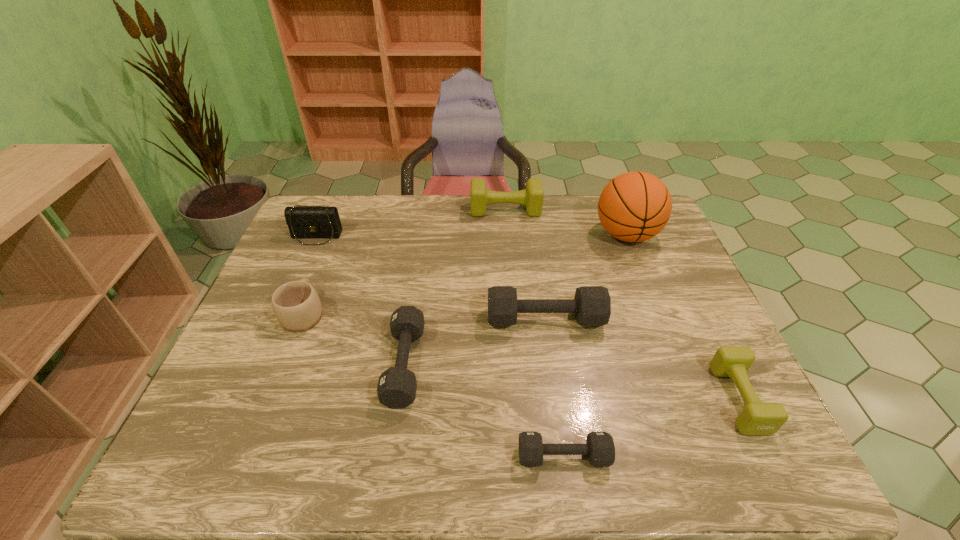
This screenshot has width=960, height=540. What are the coordinates of `the smaller olive dumbbell` in the screenshot? It's located at (757, 418).

The height and width of the screenshot is (540, 960). In order to click on the smallest gray dumbbell in this screenshot , I will do `click(599, 447)`.

Locate an element on the screen. This screenshot has width=960, height=540. the nearest gray dumbbell is located at coordinates (599, 447).

You are a GUI agent. You are given a task and a screenshot of the screen. Output one action in this format:
    pyautogui.click(x=<x>, y=<y>)
    Task: Click on the vacant position located 0.160m on the left of the tallest object
    The height and width of the screenshot is (540, 960).
    Given the screenshot: What is the action you would take?
    pyautogui.click(x=543, y=235)

The width and height of the screenshot is (960, 540). I want to click on vacant area situated 0.250m on the left of the bigger olive dumbbell, so click(x=398, y=210).

Locate an element on the screen. Image resolution: width=960 pixels, height=540 pixels. free spot located 0.130m on the front flap of the clutch bag is located at coordinates (300, 274).

You are a GUI agent. You are given a task and a screenshot of the screen. Output one action in this format:
    pyautogui.click(x=<x>, y=<y>)
    Task: Click on the vacant space located on the front of the biggest gray dumbbell
    The width and height of the screenshot is (960, 540).
    Given the screenshot: What is the action you would take?
    pyautogui.click(x=555, y=388)

You are a GUI agent. You are given a task and a screenshot of the screen. Output one action in this format:
    pyautogui.click(x=<x>, y=<y>)
    Task: Click on the free space located on the side of the mug with the handle
    The width and height of the screenshot is (960, 540).
    Given the screenshot: What is the action you would take?
    pyautogui.click(x=317, y=279)

The image size is (960, 540). In order to click on vacant region located on the side of the mug with the handle in this screenshot , I will do `click(332, 240)`.

At what (x,y) coordinates should I click in order to perform the action: click on vacant area located 0.140m on the side of the mug with the handle. Please return your answer as a coordinate pair (x, y). The image size is (960, 540). Looking at the image, I should click on (324, 261).